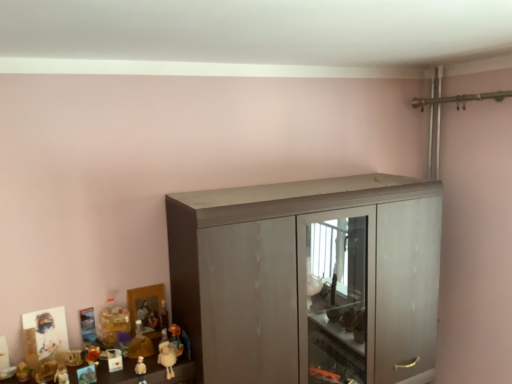
Question: From a real-world perspective, is matte gray cupboard at center physically located above or below shiny orange toy at lower left, which appears as the 3th toy when viewed from the left?

Choices:
 (A) above
 (B) below

Answer: (A)

Question: Relative to shiny orange toy at lower left, which appears as the 3th toy when viewed from the left, is matte gray cupboard at center in front or behind?

Choices:
 (A) behind
 (B) front

Answer: (B)

Question: Estimate the real-world distances between objects in this image. Which object is closer to the matte plastic figurine at lower left, which ranks as the second toy in right-to-left order?

Choices:
 (A) white plush sheep at lower left, which ranks as the 8th toy in left-to-right order
 (B) matte brown figurine at lower left, the second toy when ordered from left to right
 (C) matte plastic toy at lower left, acting as the 4th toy starting from the left
 (D) translucent plastic toy at lower left, arranged as the fourth toy when viewed from the right
 (E) matte gray cupboard at center

Answer: (A)

Question: Which of these objects is positioned closest to the white plush sheep at lower left, which ranks as the 8th toy in left-to-right order?

Choices:
 (A) matte plastic figurine at lower left, which ranks as the second toy in right-to-left order
 (B) matte plastic toy at lower left, which appears as the 6th toy when viewed from the left
 (C) matte gray cupboard at center
 (D) matte plastic toy at lower left, acting as the 4th toy starting from the left
 (E) matte plastic toy at lower left, which is the 1th toy from left to right

Answer: (A)